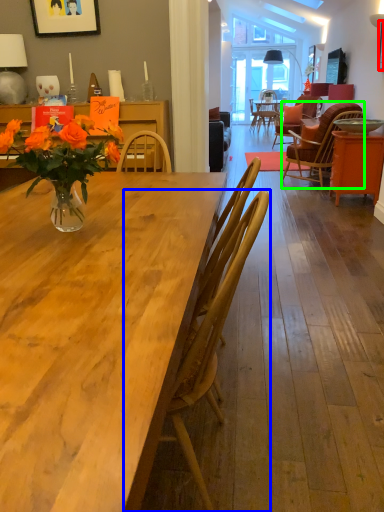
Question: Estimate the real-world distances between objects in this image. Which object is farther from picture frame (highlighted by a red box), chair (highlighted by a blue box) or chair (highlighted by a green box)?

Choices:
 (A) chair
 (B) chair

Answer: (A)